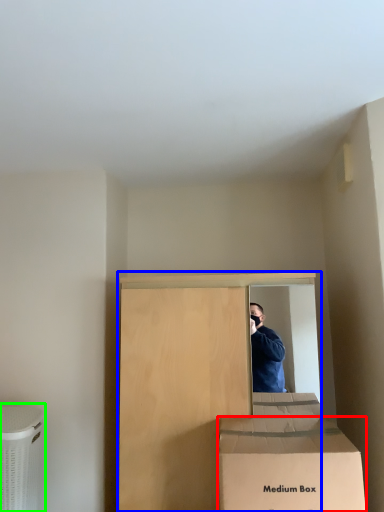
Question: Considering the real-world distances, which object is closest to box (highlighted by a red box)? furniture (highlighted by a blue box) or cardboard box (highlighted by a green box).

Choices:
 (A) furniture
 (B) cardboard box

Answer: (A)